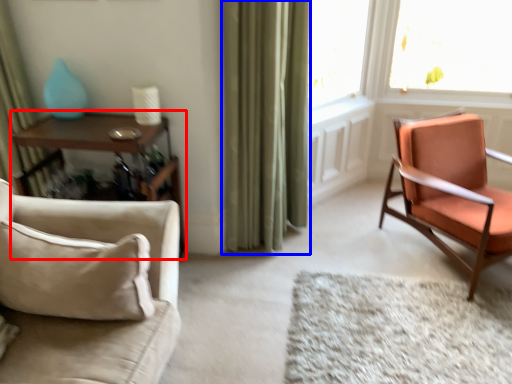
Question: Which point is further to the camera, table (highlighted by a red box) or curtain (highlighted by a blue box)?

Choices:
 (A) table
 (B) curtain

Answer: (A)